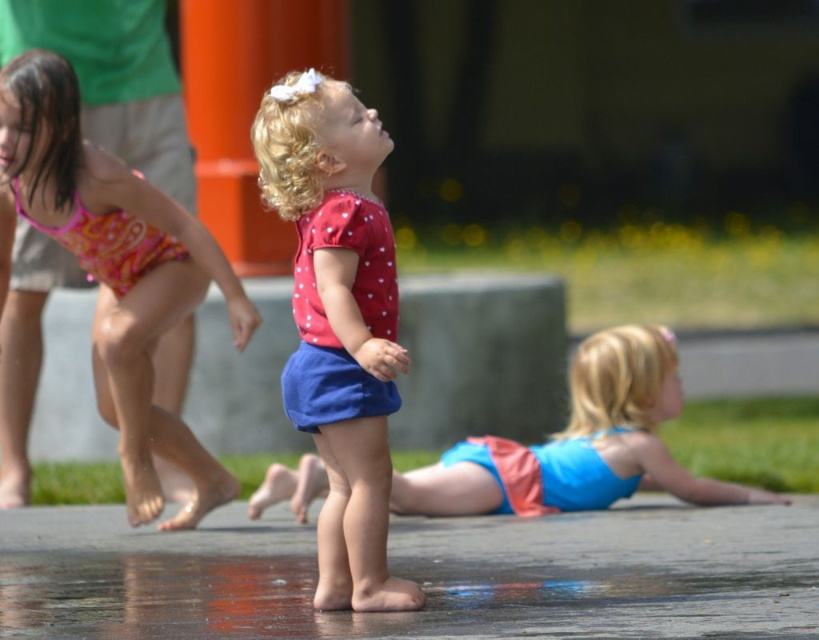
You are a photographer trying to capture the child in the pink and orange pattern at left. The camera is positioned at the point marked by coordinates point [115,269]. What is the direction you should adjust the camera to frame the child in the pink and orange pattern at left?

The point [115,269] marks the pink fabric swimsuit at left, so the camera is already positioned at the location of the child in the pink and orange pattern at left. No adjustment is needed.

You are a parent supervising children at the playground. You notice the wet concrete pavement at center and the pink fabric swimsuit at left. Which object is lower in the image?

The wet concrete pavement at center is below the pink fabric swimsuit at left, so the wet concrete pavement at center is lower in the image.